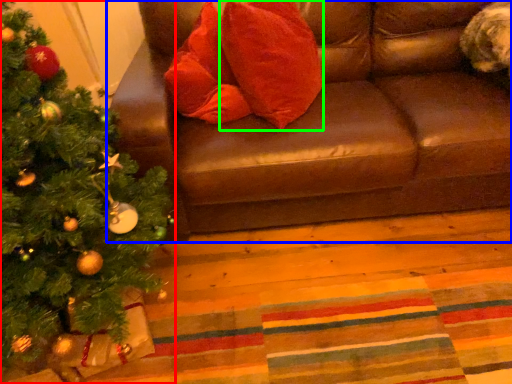
Question: Which object is positioned closest to christmas tree (highlighted by a red box)? Select from studio couch (highlighted by a blue box) and throw pillow (highlighted by a green box).

Choices:
 (A) studio couch
 (B) throw pillow

Answer: (A)